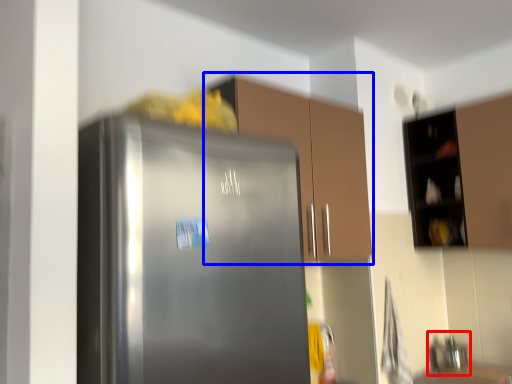
Question: Which object appears farthest to the camera in this image, sink (highlighted by a red box) or cabinetry (highlighted by a blue box)?

Choices:
 (A) sink
 (B) cabinetry

Answer: (A)